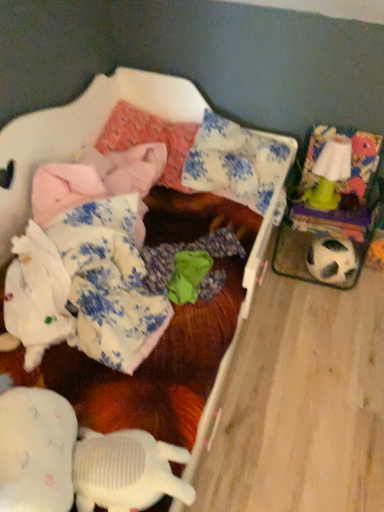
Question: Is fluffy pink blanket at upper left touching green plastic lamp at upper right?

Choices:
 (A) no
 (B) yes

Answer: (A)

Question: From the image's perspective, would you say fluffy pink blanket at upper left is positioned over green plastic lamp at upper right?

Choices:
 (A) yes
 (B) no

Answer: (B)

Question: From a real-world perspective, is fluffy pink blanket at upper left beneath green plastic lamp at upper right?

Choices:
 (A) yes
 (B) no

Answer: (A)

Question: Is the position of fluffy pink blanket at upper left less distant than that of green plastic lamp at upper right?

Choices:
 (A) no
 (B) yes

Answer: (B)

Question: From a real-world perspective, is fluffy pink blanket at upper left on top of green plastic lamp at upper right?

Choices:
 (A) yes
 (B) no

Answer: (B)

Question: In terms of height, does white fabric at lower left, positioned as the first clothing in left-to-right order, look taller or shorter compared to fluffy pink blanket at upper left?

Choices:
 (A) tall
 (B) short

Answer: (B)

Question: Based on their positions, is white fabric at lower left, positioned as the first clothing in left-to-right order, located to the left or right of fluffy pink blanket at upper left?

Choices:
 (A) right
 (B) left

Answer: (B)

Question: From the image's perspective, is white fabric at lower left, the 2th clothing from the right, located above or below fluffy pink blanket at upper left?

Choices:
 (A) below
 (B) above

Answer: (A)

Question: Is point (129, 326) closer or farther from the camera than point (54, 109)?

Choices:
 (A) closer
 (B) farther

Answer: (A)

Question: Looking at their shapes, would you say pink fabric pillow at upper center, placed as the second pillow when sorted from right to left, is wider or thinner than blue floral fabric pillow at center, which is the second pillow from left to right?

Choices:
 (A) wide
 (B) thin

Answer: (B)

Question: Is point (198, 125) positioned closer to the camera than point (274, 141)?

Choices:
 (A) closer
 (B) farther

Answer: (B)

Question: Considering the positions of pink fabric pillow at upper center, placed as the second pillow when sorted from right to left, and blue floral fabric pillow at center, marked as the 1th pillow in a right-to-left arrangement, in the image, is pink fabric pillow at upper center, placed as the second pillow when sorted from right to left, taller or shorter than blue floral fabric pillow at center, marked as the 1th pillow in a right-to-left arrangement,?

Choices:
 (A) tall
 (B) short

Answer: (B)

Question: Is pink fabric pillow at upper center, positioned as the 1th pillow in left-to-right order, inside the boundaries of blue floral fabric pillow at center, which is the second pillow from left to right, or outside?

Choices:
 (A) inside
 (B) outside

Answer: (B)

Question: Is black and white textured football at right situated inside pink fabric pillow at upper center, placed as the second pillow when sorted from right to left, or outside?

Choices:
 (A) inside
 (B) outside

Answer: (B)

Question: In the image, is black and white textured football at right positioned in front of or behind pink fabric pillow at upper center, placed as the second pillow when sorted from right to left?

Choices:
 (A) behind
 (B) front

Answer: (A)